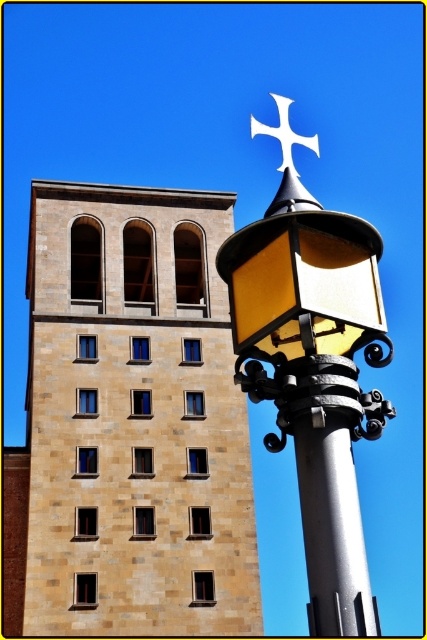
Can you confirm if silver metallic pole at center is positioned above white metal cross at upper center?

No, silver metallic pole at center is not above white metal cross at upper center.

Is silver metallic pole at center in front of white metal cross at upper center?

Yes, it is.

Does point (359, 588) come behind point (287, 156)?

That is False.

Locate an element on the screen. The height and width of the screenshot is (640, 427). silver metallic pole at center is located at coordinates (330, 493).

Is metallic/yellow street light at upper right bigger than silver metallic pole at center?

Indeed, metallic/yellow street light at upper right has a larger size compared to silver metallic pole at center.

Is point (368, 252) positioned after point (321, 545)?

Yes.

Between point (294, 356) and point (310, 529), which one is positioned in front?

Positioned in front is point (310, 529).

The height and width of the screenshot is (640, 427). I want to click on metallic/yellow street light at upper right, so click(312, 368).

Can you confirm if brown stone building at upper left is taller than white metal cross at upper center?

In fact, brown stone building at upper left may be shorter than white metal cross at upper center.

Can you confirm if brown stone building at upper left is wider than white metal cross at upper center?

Yes.

Where is `brown stone building at upper left`? Image resolution: width=427 pixels, height=640 pixels. brown stone building at upper left is located at coordinates click(x=134, y=419).